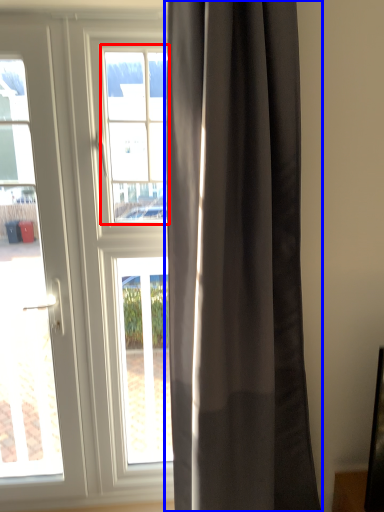
Question: Which object appears farthest to the camera in this image, bay window (highlighted by a red box) or curtain (highlighted by a blue box)?

Choices:
 (A) bay window
 (B) curtain

Answer: (A)